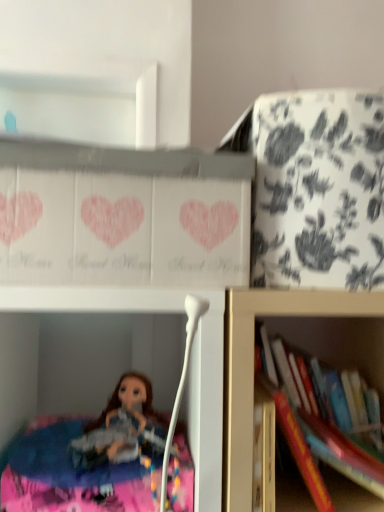
Question: Is white floral-patterned cabinet at upper right, positioned as the 2th cabinet in left-to-right order, in front of hardcover book at right, arranged as the second book when viewed from the front?

Choices:
 (A) no
 (B) yes

Answer: (B)

Question: Considering the relative sizes of white floral-patterned cabinet at upper right, positioned as the first cabinet in right-to-left order, and hardcover book at right, arranged as the second book when viewed from the front, in the image provided, is white floral-patterned cabinet at upper right, positioned as the first cabinet in right-to-left order, shorter than hardcover book at right, arranged as the second book when viewed from the front,?

Choices:
 (A) yes
 (B) no

Answer: (B)

Question: From a real-world perspective, is white floral-patterned cabinet at upper right, positioned as the first cabinet in right-to-left order, positioned under hardcover book at right, arranged as the second book when viewed from the front, based on gravity?

Choices:
 (A) no
 (B) yes

Answer: (A)

Question: Does white floral-patterned cabinet at upper right, positioned as the 2th cabinet in left-to-right order, have a lesser width compared to hardcover book at right, arranged as the second book when viewed from the front?

Choices:
 (A) yes
 (B) no

Answer: (B)

Question: Is white floral-patterned cabinet at upper right, positioned as the 2th cabinet in left-to-right order, not close to hardcover book at right, arranged as the second book when viewed from the front?

Choices:
 (A) no
 (B) yes

Answer: (A)

Question: From a real-world perspective, is hardcover book at lower right, positioned as the 2th book in back-to-front order, positioned above or below hardcover book at right, placed as the first book when sorted from back to front?

Choices:
 (A) above
 (B) below

Answer: (B)

Question: From the image's perspective, relative to hardcover book at right, arranged as the second book when viewed from the front, is hardcover book at lower right, positioned as the 2th book in back-to-front order, above or below?

Choices:
 (A) above
 (B) below

Answer: (B)

Question: In terms of size, does hardcover book at lower right, positioned as the 2th book in back-to-front order, appear bigger or smaller than hardcover book at right, placed as the first book when sorted from back to front?

Choices:
 (A) small
 (B) big

Answer: (A)

Question: Is hardcover book at lower right, acting as the 1th book starting from the front, wider or thinner than hardcover book at right, placed as the first book when sorted from back to front?

Choices:
 (A) wide
 (B) thin

Answer: (A)

Question: From the image's perspective, is white floral-patterned cabinet at upper right, positioned as the first cabinet in right-to-left order, above or below hardcover book at lower right, acting as the 1th book starting from the front?

Choices:
 (A) below
 (B) above

Answer: (B)

Question: Is white floral-patterned cabinet at upper right, positioned as the 2th cabinet in left-to-right order, wider or thinner than hardcover book at lower right, positioned as the 2th book in back-to-front order?

Choices:
 (A) wide
 (B) thin

Answer: (A)

Question: Is white floral-patterned cabinet at upper right, positioned as the first cabinet in right-to-left order, bigger or smaller than hardcover book at lower right, acting as the 1th book starting from the front?

Choices:
 (A) big
 (B) small

Answer: (A)

Question: From a real-world perspective, is white floral-patterned cabinet at upper right, positioned as the 2th cabinet in left-to-right order, positioned above or below hardcover book at lower right, positioned as the 2th book in back-to-front order?

Choices:
 (A) below
 (B) above

Answer: (B)

Question: From a real-world perspective, relative to white floral-patterned cabinet at upper right, positioned as the 2th cabinet in left-to-right order, is hardcover book at right, arranged as the second book when viewed from the front, vertically above or below?

Choices:
 (A) below
 (B) above

Answer: (A)

Question: Looking at their shapes, would you say hardcover book at right, placed as the first book when sorted from back to front, is wider or thinner than white floral-patterned cabinet at upper right, positioned as the 2th cabinet in left-to-right order?

Choices:
 (A) wide
 (B) thin

Answer: (B)